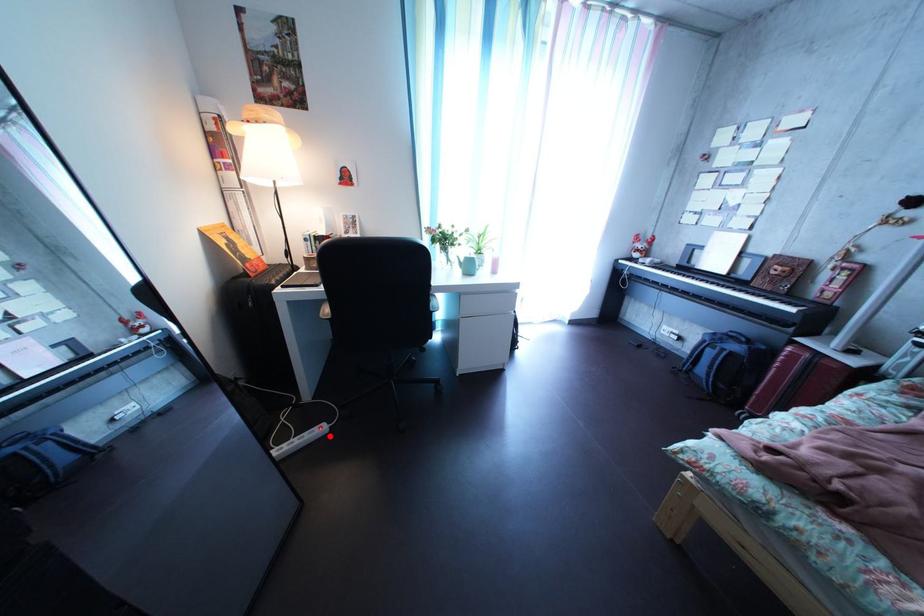
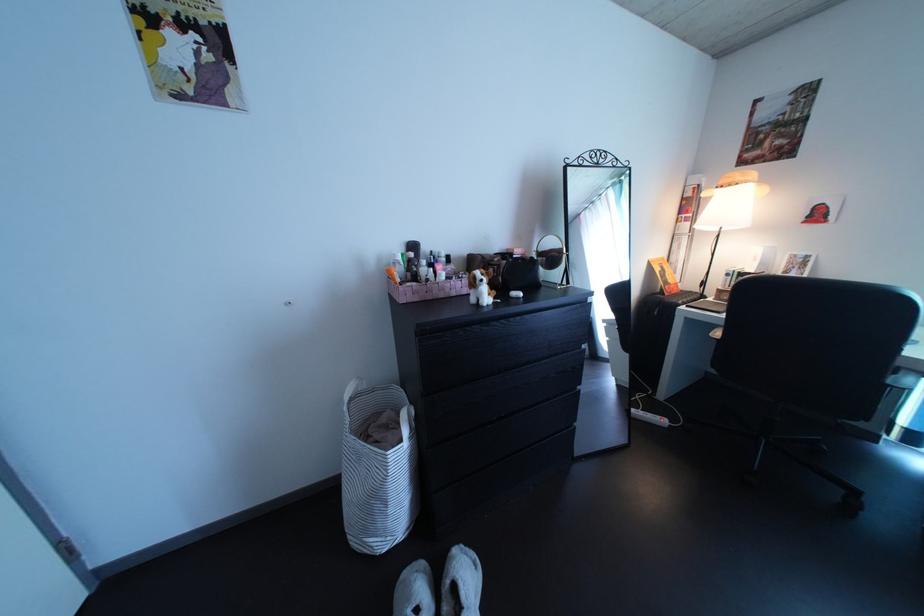
Question: I am providing you with two images of the same scene from different viewpoints. A red point is shown in image1. For the corresponding object point in image2, is it positioned nearer or farther from the camera?

Choices:
 (A) Nearer
 (B) Farther

Answer: (B)